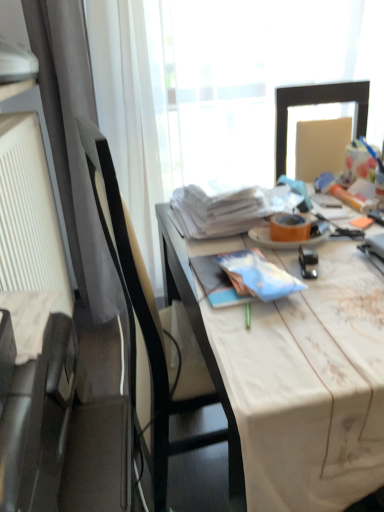
Where is `free space in front of metallic black stapler at center-right`? free space in front of metallic black stapler at center-right is located at coordinates (327, 308).